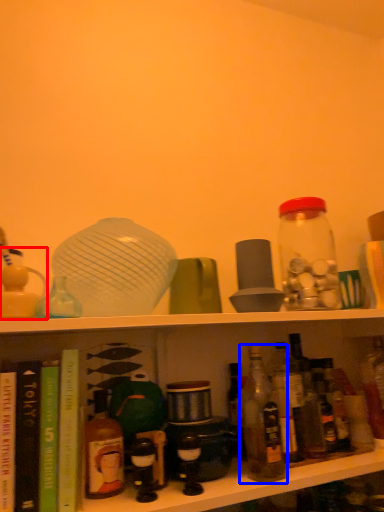
Question: Which object appears farthest to the camera in this image, toy (highlighted by a red box) or bottle (highlighted by a blue box)?

Choices:
 (A) toy
 (B) bottle

Answer: (B)